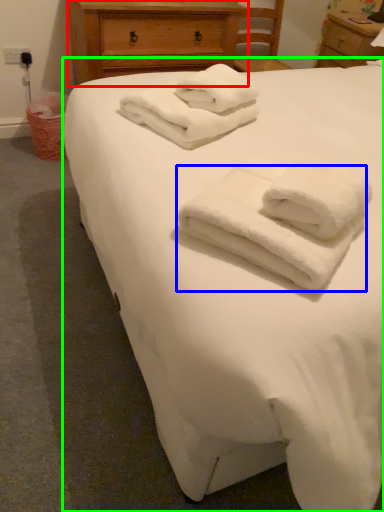
Question: Estimate the real-world distances between objects in this image. Which object is closer to chest of drawers (highlighted by a red box), towel (highlighted by a blue box) or bed (highlighted by a green box)?

Choices:
 (A) towel
 (B) bed

Answer: (B)